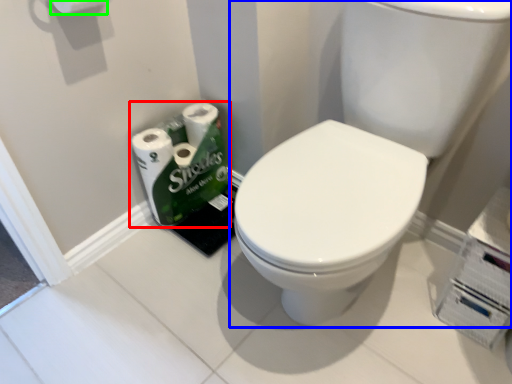
Question: Which object is the farthest from toilet paper (highlighted by a red box)? Choose among these: sink (highlighted by a blue box) or toilet paper (highlighted by a green box).

Choices:
 (A) sink
 (B) toilet paper

Answer: (B)